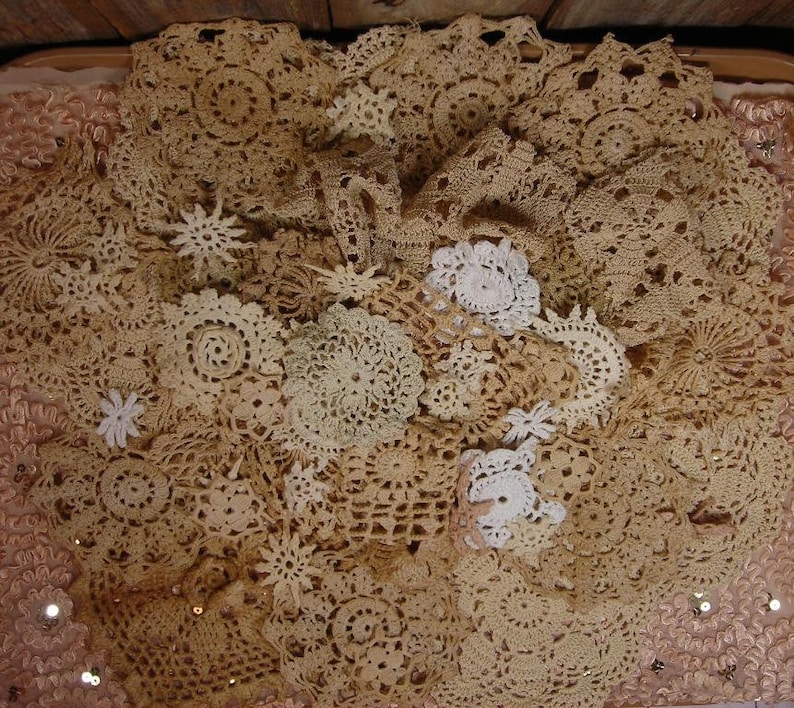
Find the location of `light reflector`. light reflector is located at coordinates (51, 610).